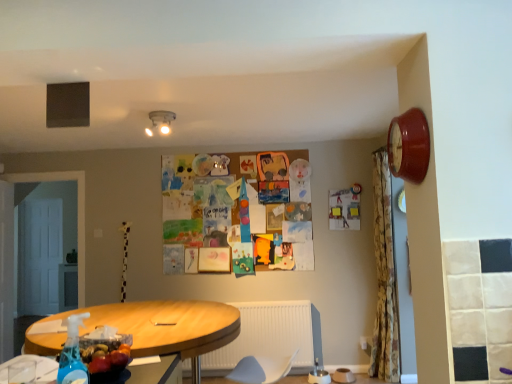
Question: Is blue translucent spray bottle at lower left surrounding shiny plastic bottle of water at lower left?

Choices:
 (A) no
 (B) yes

Answer: (A)

Question: Is blue translucent spray bottle at lower left taller than shiny plastic bottle of water at lower left?

Choices:
 (A) yes
 (B) no

Answer: (A)

Question: Can you confirm if blue translucent spray bottle at lower left is positioned to the right of shiny plastic bottle of water at lower left?

Choices:
 (A) no
 (B) yes

Answer: (B)

Question: Is shiny plastic bottle of water at lower left at the back of blue translucent spray bottle at lower left?

Choices:
 (A) no
 (B) yes

Answer: (A)

Question: From the image's perspective, is blue translucent spray bottle at lower left over shiny plastic bottle of water at lower left?

Choices:
 (A) yes
 (B) no

Answer: (A)

Question: Is blue translucent spray bottle at lower left to the left of shiny plastic bottle of water at lower left from the viewer's perspective?

Choices:
 (A) yes
 (B) no

Answer: (B)

Question: From a real-world perspective, is light blue fabric swivel chair at lower center positioned under shiny plastic bottle of water at lower left based on gravity?

Choices:
 (A) no
 (B) yes

Answer: (B)

Question: Considering the relative sizes of light blue fabric swivel chair at lower center and shiny plastic bottle of water at lower left in the image provided, is light blue fabric swivel chair at lower center shorter than shiny plastic bottle of water at lower left?

Choices:
 (A) no
 (B) yes

Answer: (A)

Question: Is light blue fabric swivel chair at lower center to the left of shiny plastic bottle of water at lower left from the viewer's perspective?

Choices:
 (A) no
 (B) yes

Answer: (A)

Question: Can you confirm if light blue fabric swivel chair at lower center is bigger than shiny plastic bottle of water at lower left?

Choices:
 (A) no
 (B) yes

Answer: (B)

Question: Is shiny plastic bottle of water at lower left at the back of light blue fabric swivel chair at lower center?

Choices:
 (A) no
 (B) yes

Answer: (A)

Question: Does light blue fabric swivel chair at lower center appear on the right side of shiny plastic bottle of water at lower left?

Choices:
 (A) no
 (B) yes

Answer: (B)

Question: Is floral fabric shower curtain at right not within blue translucent spray bottle at lower left?

Choices:
 (A) yes
 (B) no

Answer: (A)